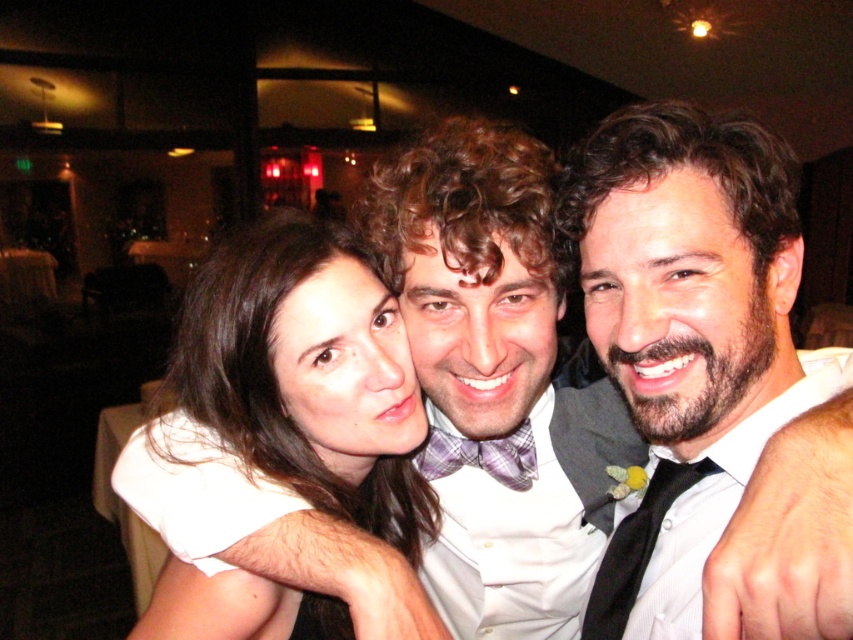
Question: Which point is farther to the camera?

Choices:
 (A) (711, 600)
 (B) (613, 636)
 (C) (180, 401)

Answer: (C)

Question: Observing the image, what is the correct spatial positioning of black satin bow tie at upper right in reference to smooth white blouse at center?

Choices:
 (A) below
 (B) above

Answer: (B)

Question: Based on their relative distances, which object is farther from the white satin bow tie at center?

Choices:
 (A) smooth white blouse at center
 (B) black satin tie at center
 (C) black satin bow tie at upper right

Answer: (B)

Question: Is smooth white blouse at center below white satin bow tie at center?

Choices:
 (A) yes
 (B) no

Answer: (A)

Question: Is black satin bow tie at upper right bigger than white satin bow tie at center?

Choices:
 (A) no
 (B) yes

Answer: (A)

Question: Which of the following is the farthest from the observer?

Choices:
 (A) black satin bow tie at upper right
 (B) black satin tie at center
 (C) smooth white blouse at center
 (D) white satin bow tie at center

Answer: (C)